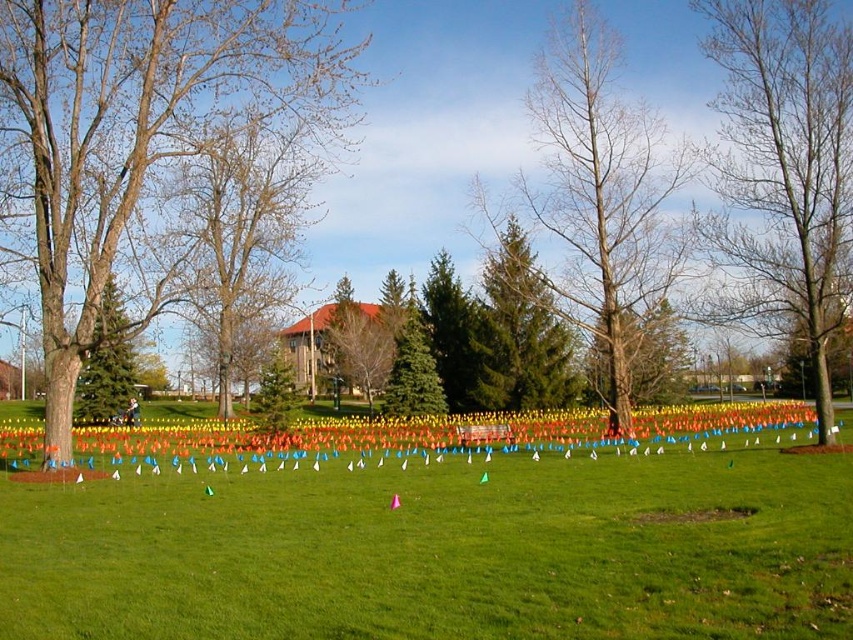
Consider the image. You are standing in the park and see the bare wood tree at right and the green matte tree at upper left. Which tree is positioned to the east of the other?

The bare wood tree at right is to the right of green matte tree at upper left, so the bare wood tree at right is positioned to the east of the green matte tree at upper left.

You are a landscape architect planning to install a new pathway between the bare wood tree at right and the bare wood tree at center. Considering their sizes, which tree will require more clearance to avoid obstruction?

The bare wood tree at center requires more clearance because it occupies more space than the bare wood tree at right.

You are a park visitor standing in the middle of the lawn with the small flags around you. You want to take a photo that includes both the bare wood tree at right and the green matte tree at upper left. Which tree should you position closer to the center of your camera frame to ensure both are visible without zooming in?

To include both the bare wood tree at right and the green matte tree at upper left in your photo without zooming, position the green matte tree at upper left closer to the center of your camera frame since it is larger and will require less adjustment to fit into the frame compared to the smaller bare wood tree at right.